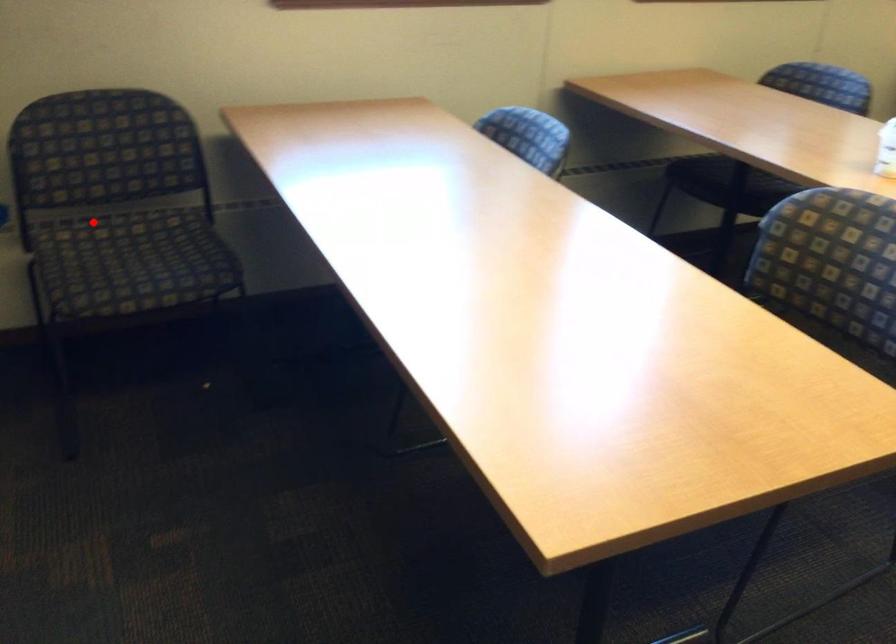
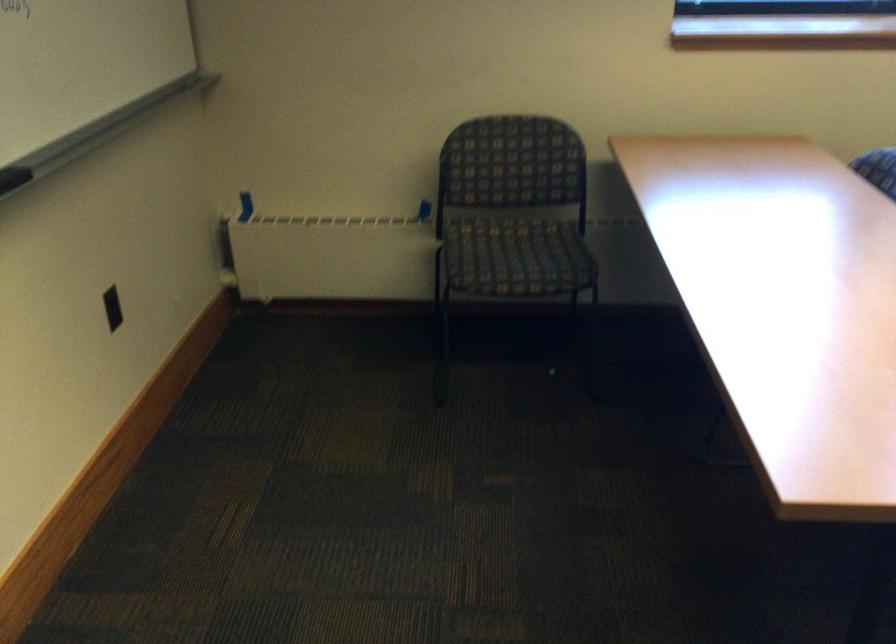
Question: I am providing you with two images of the same scene from different viewpoints. In image1, a red point is highlighted. Considering the same 3D point in image2, which of the following is correct?

Choices:
 (A) It is closer
 (B) It is farther

Answer: (B)